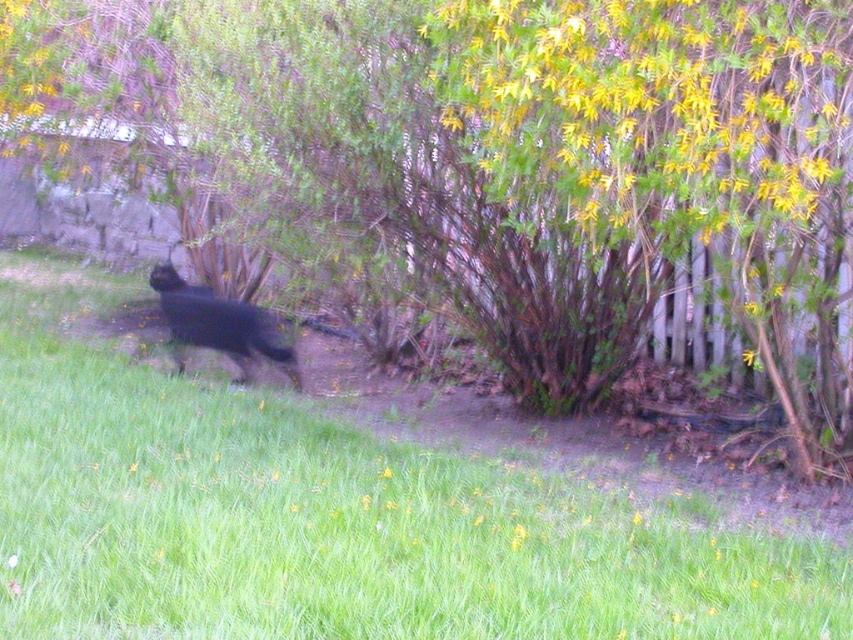
Question: Which of the following is the closest to the observer?

Choices:
 (A) black furry dog at center
 (B) green grass at lower left

Answer: (B)

Question: Can you confirm if green grass at lower left is positioned above black furry dog at center?

Choices:
 (A) yes
 (B) no

Answer: (B)

Question: Is green grass at lower left thinner than black furry dog at center?

Choices:
 (A) no
 (B) yes

Answer: (B)

Question: Does green grass at lower left come behind black furry dog at center?

Choices:
 (A) yes
 (B) no

Answer: (B)

Question: Among these points, which one is farthest from the camera?

Choices:
 (A) (61, 586)
 (B) (289, 358)

Answer: (B)